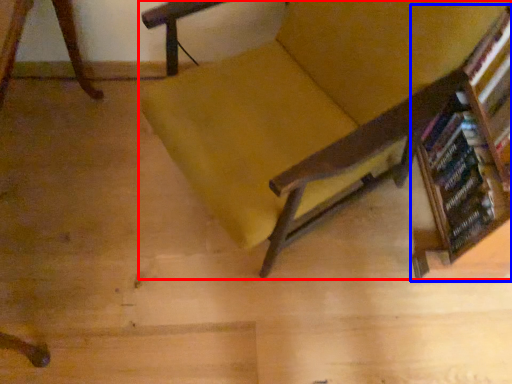
Question: Which point is further to the camera, chair (highlighted by a red box) or bookcase (highlighted by a blue box)?

Choices:
 (A) chair
 (B) bookcase

Answer: (B)